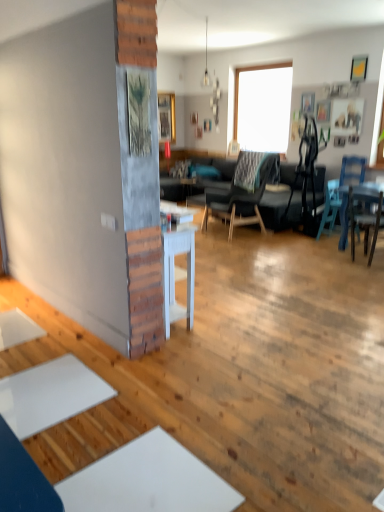
Question: Is point (140, 91) positioned closer to the camera than point (342, 244)?

Choices:
 (A) closer
 (B) farther

Answer: (A)

Question: Considering their positions, is wooden textured picture frame at center, acting as the 5th picture frame starting from the right, located in front of or behind blue plastic chair at right, the 2th chair from the left?

Choices:
 (A) behind
 (B) front

Answer: (B)

Question: Based on their relative distances, which object is farther from the wooden picture frame at upper right, which ranks as the third picture frame in front-to-back order?

Choices:
 (A) wooden picture frame at upper right, positioned as the 5th picture frame in front-to-back order
 (B) wooden textured picture frame at center, which is the 6th picture frame from top to bottom
 (C) white painted wood table at center
 (D) wooden picture frame at center, the 1th picture frame viewed from the top
 (E) dark gray fabric couch at center

Answer: (B)

Question: Which object is the farthest from the white painted wood table at center?

Choices:
 (A) wooden picture frame at upper right, the fifth picture frame from the left
 (B) wooden picture frame at upper right, placed as the third picture frame when sorted from bottom to top
 (C) dark gray fabric couch at center
 (D) wooden picture frame at upper right, which is the fifth picture frame in bottom-to-top order
 (E) wooden picture frame at center, the 1th picture frame from the left

Answer: (E)